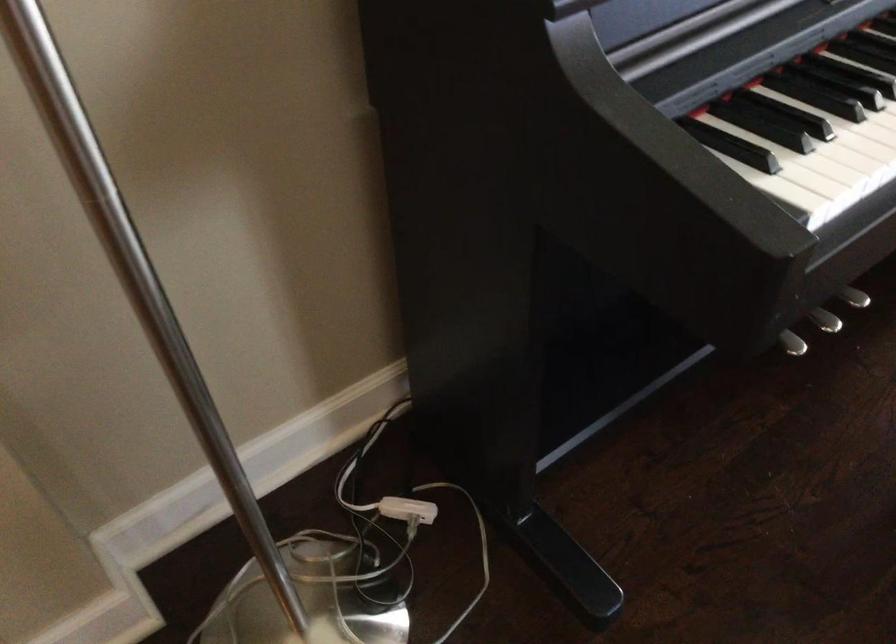
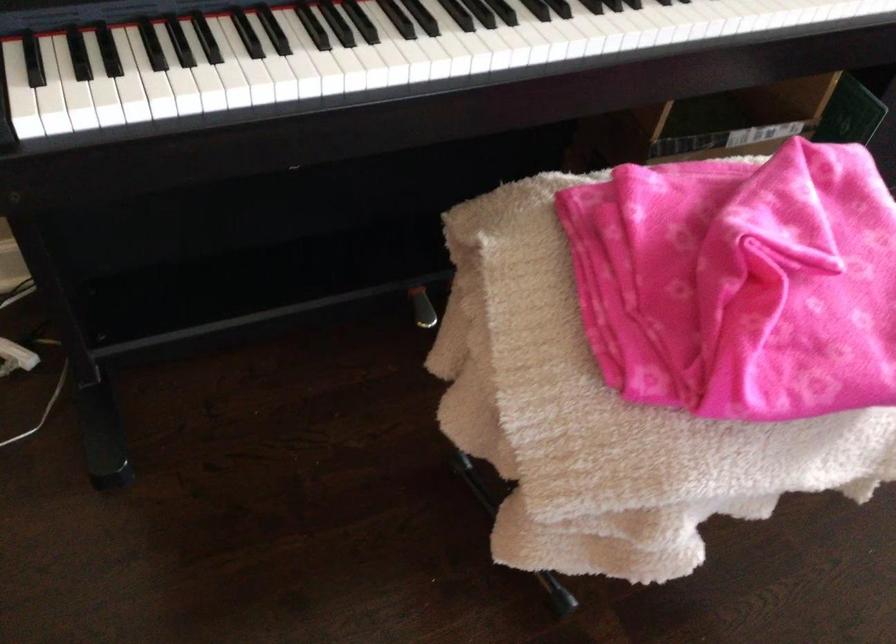
Locate, in the second image, the point that corresponds to point (806, 146) in the first image.

(87, 80)